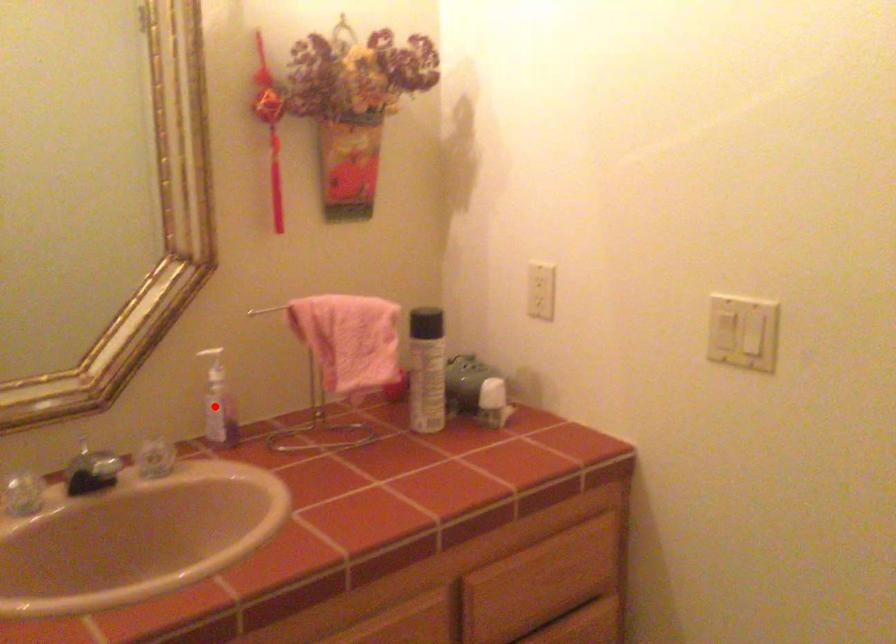
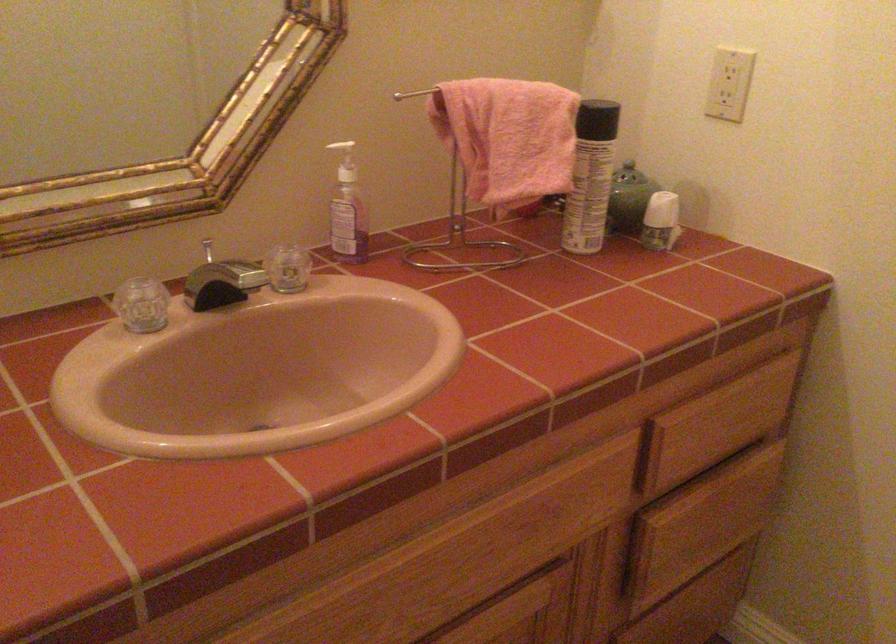
Question: I am providing you with two images of the same scene from different viewpoints. Given a red point in image1, look at the same physical point in image2. Is it:

Choices:
 (A) Closer to the viewpoint
 (B) Farther from the viewpoint

Answer: (A)